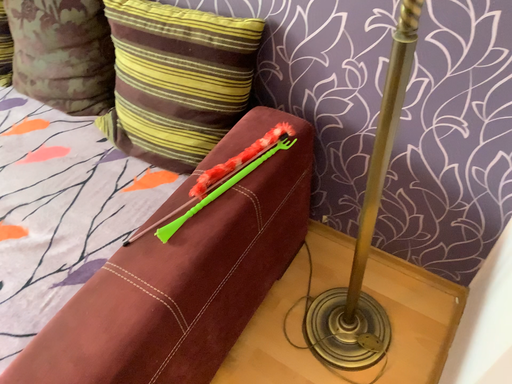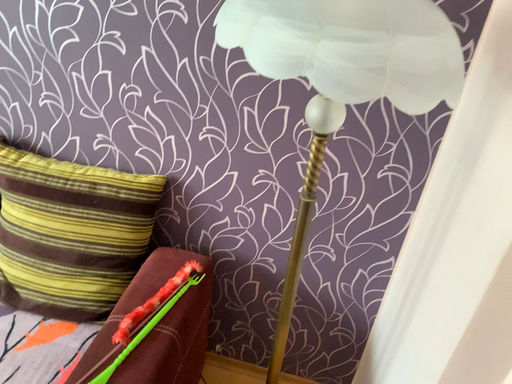
Question: Which way did the camera rotate in the video?

Choices:
 (A) rotated right
 (B) rotated left

Answer: (A)